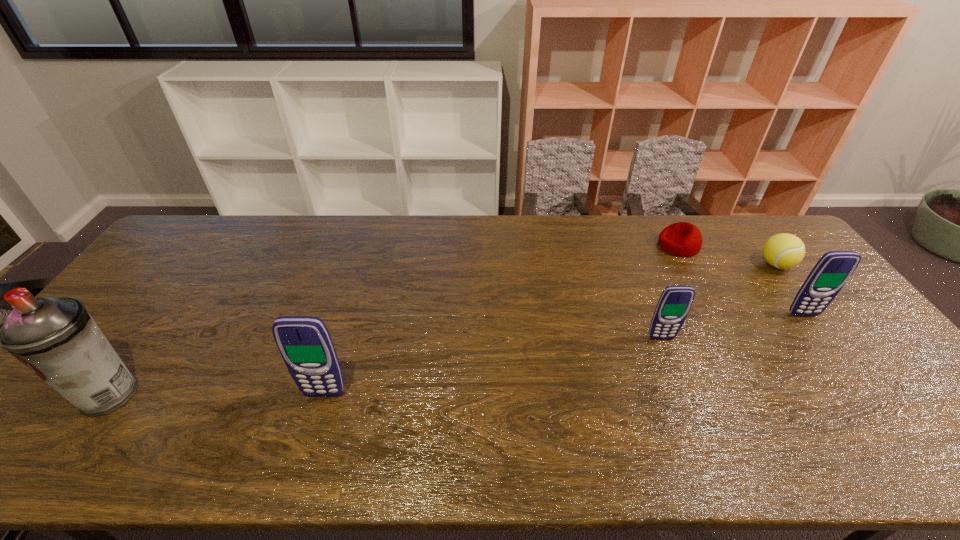
To ensure equal spacing by inserting another cellular_telephone among them, please point out a vacant spot for this new cellular_telephone. Please provide its 2D coordinates. Your answer should be formatted as a tuple, i.e. [(x, y)], where the tuple contains the x and y coordinates of a point satisfying the conditions above.

[(502, 364)]